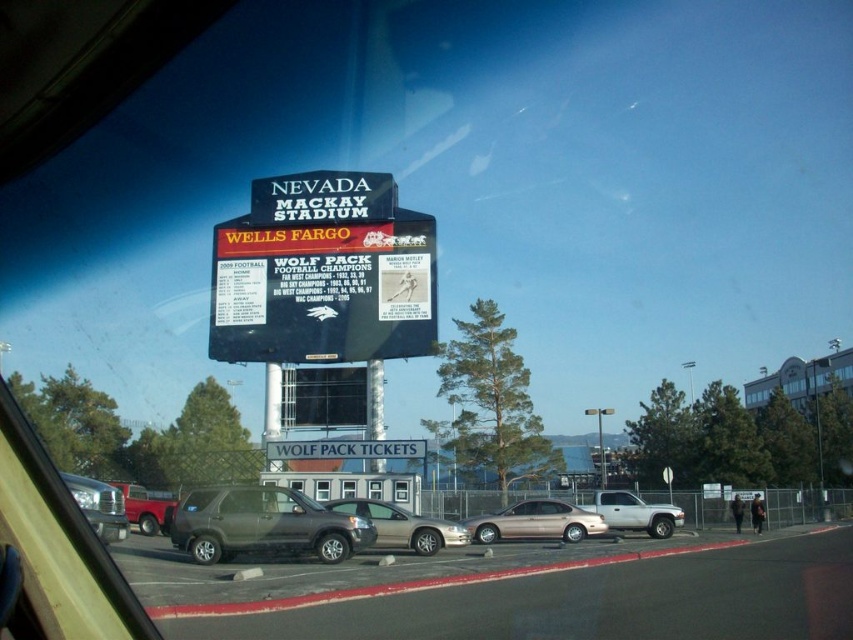
Is black plastic billboard at center thinner than matte gray suv at center?

In fact, black plastic billboard at center might be wider than matte gray suv at center.

Can you confirm if black plastic billboard at center is bigger than matte gray suv at center?

Yes.

The width and height of the screenshot is (853, 640). Describe the element at coordinates (323, 273) in the screenshot. I see `black plastic billboard at center` at that location.

Where is `black plastic billboard at center`? Image resolution: width=853 pixels, height=640 pixels. black plastic billboard at center is located at coordinates (323, 273).

Does gold metallic sedan at center have a larger size compared to silver metallic truck at center?

Incorrect, gold metallic sedan at center is not larger than silver metallic truck at center.

In the scene shown: Is gold metallic sedan at center further to the viewer compared to silver metallic truck at center?

That is False.

The image size is (853, 640). What are the coordinates of `gold metallic sedan at center` in the screenshot? It's located at (537, 522).

Is black plastic billboard at center smaller than silver metallic truck at center?

No.

Between black plastic billboard at center and silver metallic truck at center, which one appears on the left side from the viewer's perspective?

Positioned to the left is black plastic billboard at center.

You are a GUI agent. You are given a task and a screenshot of the screen. Output one action in this format:
    pyautogui.click(x=<x>, y=<y>)
    Task: Click on the black plastic billboard at center
    The image size is (853, 640).
    Given the screenshot: What is the action you would take?
    pyautogui.click(x=323, y=273)

Where is `black plastic billboard at center`? The height and width of the screenshot is (640, 853). black plastic billboard at center is located at coordinates (323, 273).